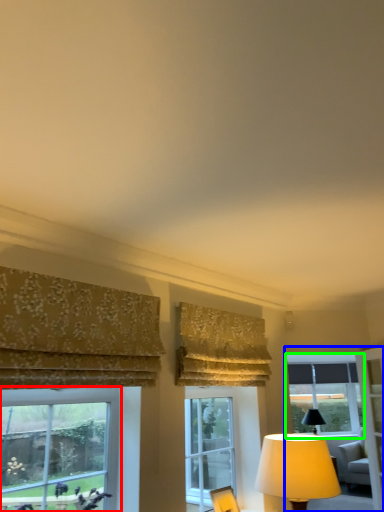
Question: Based on their relative distances, which object is farther from window (highlighted by a red box)? Choose from window frame (highlighted by a blue box) and window (highlighted by a green box).

Choices:
 (A) window frame
 (B) window

Answer: (B)